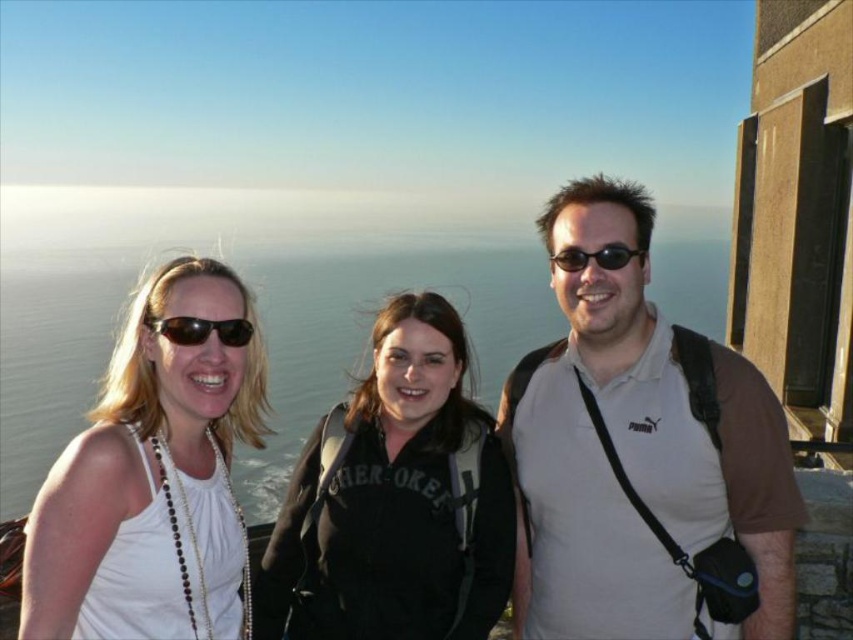
Does black matte jacket at center have a lesser width compared to black plastic sunglasses at center?

No.

Is black matte jacket at center below black plastic sunglasses at center?

Indeed, black matte jacket at center is positioned under black plastic sunglasses at center.

Measure the distance between black matte jacket at center and camera.

black matte jacket at center and camera are 23.57 meters apart.

Where is `black matte jacket at center`? This screenshot has width=853, height=640. black matte jacket at center is located at coordinates (395, 500).

Can you confirm if black matte jacket at center is bigger than matte black sunglasses at center?

Indeed, black matte jacket at center has a larger size compared to matte black sunglasses at center.

Who is positioned more to the right, black matte jacket at center or matte black sunglasses at center?

Positioned to the right is black matte jacket at center.

Which is in front, point (306, 566) or point (242, 323)?

Positioned in front is point (242, 323).

At what (x,y) coordinates should I click in order to perform the action: click on black matte jacket at center. Please return your answer as a coordinate pair (x, y). This screenshot has width=853, height=640. Looking at the image, I should click on (395, 500).

Is black matte jacket at center taller than white matte tank top at left?

In fact, black matte jacket at center may be shorter than white matte tank top at left.

Which is more to the right, black matte jacket at center or white matte tank top at left?

Positioned to the right is black matte jacket at center.

Does point (375, 451) come closer to viewer compared to point (33, 536)?

No, it is behind (33, 536).

Locate an element on the screen. This screenshot has width=853, height=640. black matte jacket at center is located at coordinates (395, 500).